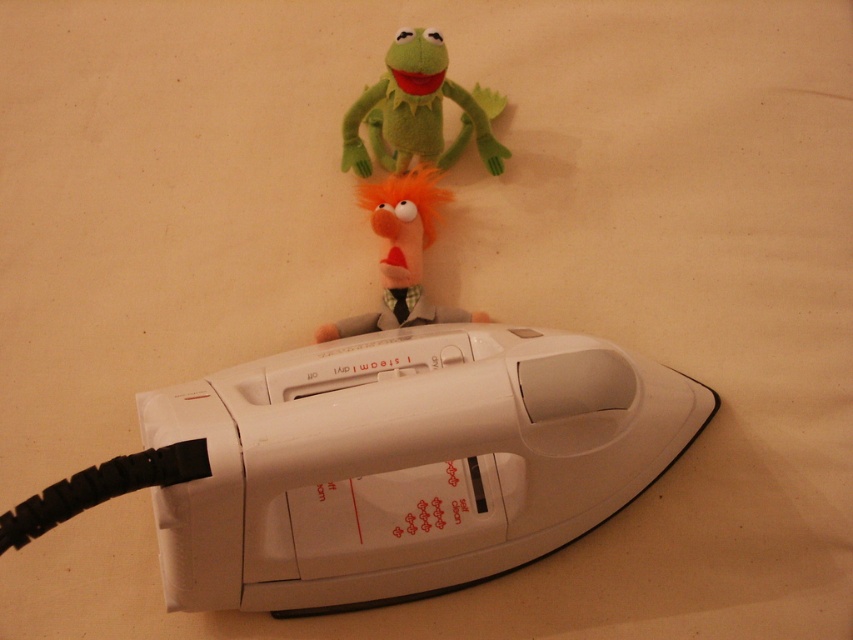
Question: Which object appears closest to the camera in this image?

Choices:
 (A) green plush frog at upper center
 (B) orange fuzzy puppet at center

Answer: (A)

Question: Can you confirm if green plush frog at upper center is wider than orange fuzzy puppet at center?

Choices:
 (A) no
 (B) yes

Answer: (A)

Question: Which object is closer to the camera taking this photo?

Choices:
 (A) green plush frog at upper center
 (B) orange fuzzy puppet at center

Answer: (A)

Question: Is green plush frog at upper center positioned before orange fuzzy puppet at center?

Choices:
 (A) no
 (B) yes

Answer: (B)

Question: Which point appears farthest from the camera in this image?

Choices:
 (A) (428, 170)
 (B) (358, 164)

Answer: (B)

Question: Observing the image, what is the correct spatial positioning of green plush frog at upper center in reference to orange fuzzy puppet at center?

Choices:
 (A) below
 (B) above

Answer: (B)